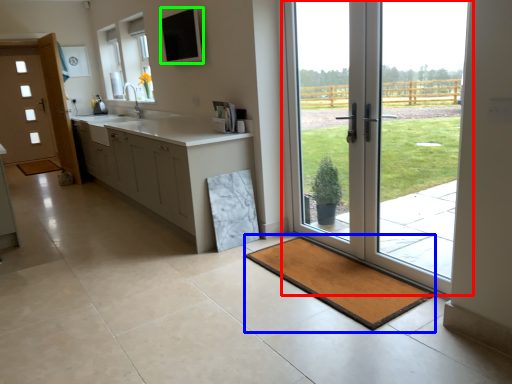
Question: Which object is the farthest from door (highlighted by a red box)? Choose among these: bath mat (highlighted by a blue box) or window screen (highlighted by a green box).

Choices:
 (A) bath mat
 (B) window screen

Answer: (B)